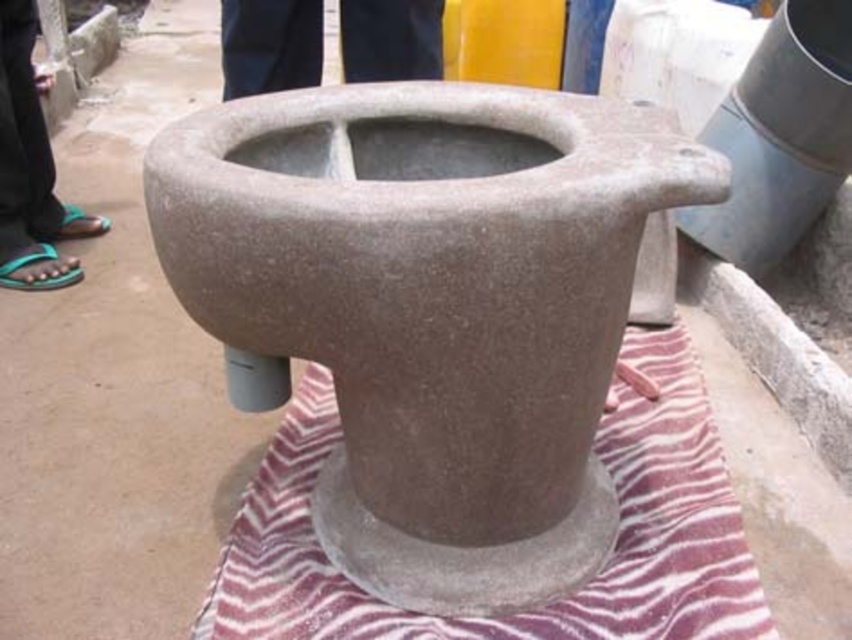
Please provide the 2D coordinates of the dark blue pants at upper center in the image.

The 2D coordinates of the dark blue pants at upper center are at point (269, 45).

You are organizing a kitchen and need to place the striped fabric mat at center and the dark blue pants at upper center. Which object should you place first to ensure proper positioning according to their sizes?

The striped fabric mat at center should be placed first because it is much taller than the dark blue pants at upper center, so it needs to be positioned properly to accommodate its height.